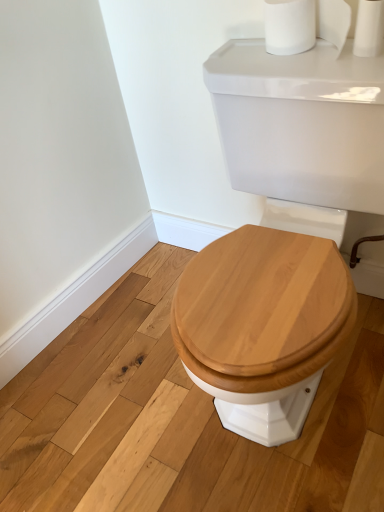
Question: Is the position of white matte toilet paper at upper right less distant than that of white glossy porcelain at center?

Choices:
 (A) yes
 (B) no

Answer: (B)

Question: Is white matte toilet paper at upper right shorter than white glossy porcelain at center?

Choices:
 (A) yes
 (B) no

Answer: (A)

Question: From the image's perspective, is white matte toilet paper at upper right beneath white glossy porcelain at center?

Choices:
 (A) yes
 (B) no

Answer: (B)

Question: Is white matte toilet paper at upper right thinner than white glossy porcelain at center?

Choices:
 (A) yes
 (B) no

Answer: (A)

Question: Is white matte toilet paper at upper right at the right side of white glossy porcelain at center?

Choices:
 (A) yes
 (B) no

Answer: (A)

Question: Can you see white matte toilet paper at upper right touching white glossy porcelain at center?

Choices:
 (A) no
 (B) yes

Answer: (A)

Question: From a real-world perspective, is white glossy porcelain at center located beneath white matte toilet paper at upper right?

Choices:
 (A) yes
 (B) no

Answer: (A)

Question: From a real-world perspective, is white glossy porcelain at center located higher than white matte toilet paper at upper right?

Choices:
 (A) no
 (B) yes

Answer: (A)

Question: Is white glossy porcelain at center outside of white matte toilet paper at upper right?

Choices:
 (A) yes
 (B) no

Answer: (A)

Question: Does white glossy porcelain at center appear on the left side of white matte toilet paper at upper right?

Choices:
 (A) yes
 (B) no

Answer: (A)

Question: Is white glossy porcelain at center thinner than white matte toilet paper at upper right?

Choices:
 (A) yes
 (B) no

Answer: (B)

Question: Considering the relative sizes of white glossy porcelain at center and white matte toilet paper at upper right in the image provided, is white glossy porcelain at center bigger than white matte toilet paper at upper right?

Choices:
 (A) yes
 (B) no

Answer: (A)

Question: Considering the positions of white matte toilet paper at upper right and white glossy porcelain at center in the image, is white matte toilet paper at upper right taller or shorter than white glossy porcelain at center?

Choices:
 (A) tall
 (B) short

Answer: (B)